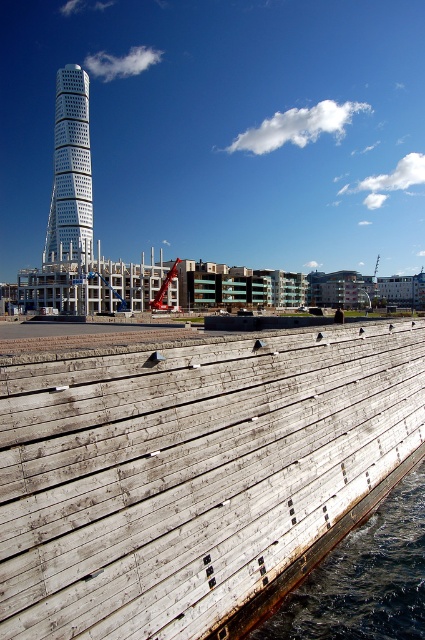
Question: Does weathered wood dock at lower left have a smaller size compared to white glass tower at upper left?

Choices:
 (A) yes
 (B) no

Answer: (A)

Question: Can you confirm if dark blue water at lower right is thinner than white glass tower at upper left?

Choices:
 (A) no
 (B) yes

Answer: (B)

Question: Which point is farther to the camera?

Choices:
 (A) pyautogui.click(x=73, y=116)
 (B) pyautogui.click(x=54, y=451)

Answer: (A)

Question: Estimate the real-world distances between objects in this image. Which object is closer to the white glass tower at upper left?

Choices:
 (A) weathered wood dock at lower left
 (B) dark blue water at lower right

Answer: (A)

Question: Which point is closer to the camera?

Choices:
 (A) (374, 524)
 (B) (231, 456)

Answer: (B)

Question: Can you confirm if dark blue water at lower right is positioned to the left of white glass tower at upper left?

Choices:
 (A) yes
 (B) no

Answer: (B)